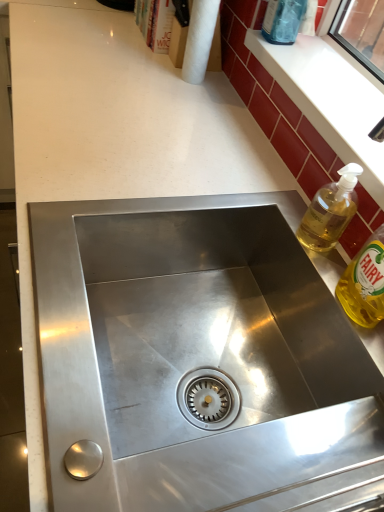
Question: From a real-world perspective, does white glossy window sill at upper right stand above translucent yellow liquid at upper right, which is the 2th bottle from bottom to top?

Choices:
 (A) yes
 (B) no

Answer: (A)

Question: Considering the relative sizes of white glossy window sill at upper right and translucent yellow liquid at upper right, which is the 2th bottle in front-to-back order, in the image provided, is white glossy window sill at upper right bigger than translucent yellow liquid at upper right, which is the 2th bottle in front-to-back order,?

Choices:
 (A) no
 (B) yes

Answer: (B)

Question: Does white glossy window sill at upper right appear on the left side of translucent yellow liquid at upper right, the 2th bottle when ordered from back to front?

Choices:
 (A) no
 (B) yes

Answer: (A)

Question: From the image's perspective, is white glossy window sill at upper right on translucent yellow liquid at upper right, which is the 2th bottle from bottom to top?

Choices:
 (A) no
 (B) yes

Answer: (B)

Question: Considering the relative sizes of white glossy window sill at upper right and translucent yellow liquid at upper right, the second bottle when ordered from top to bottom, in the image provided, is white glossy window sill at upper right taller than translucent yellow liquid at upper right, the second bottle when ordered from top to bottom,?

Choices:
 (A) no
 (B) yes

Answer: (A)

Question: Is white glossy window sill at upper right further to the viewer compared to translucent yellow liquid at upper right, the second bottle when ordered from top to bottom?

Choices:
 (A) no
 (B) yes

Answer: (B)

Question: Is transparent glass bottle at upper right, the 1th bottle when ordered from top to bottom, oriented away from white paper towel at upper center?

Choices:
 (A) no
 (B) yes

Answer: (A)

Question: Considering the relative positions of transparent glass bottle at upper right, the 1th bottle when ordered from top to bottom, and white paper towel at upper center in the image provided, is transparent glass bottle at upper right, the 1th bottle when ordered from top to bottom, to the left of white paper towel at upper center from the viewer's perspective?

Choices:
 (A) yes
 (B) no

Answer: (B)

Question: Would you say white paper towel at upper center is part of transparent glass bottle at upper right, the 3th bottle in the bottom-to-top sequence,'s contents?

Choices:
 (A) no
 (B) yes

Answer: (A)

Question: Is transparent glass bottle at upper right, the 3th bottle in the bottom-to-top sequence, facing towards white paper towel at upper center?

Choices:
 (A) yes
 (B) no

Answer: (B)

Question: From a real-world perspective, is transparent glass bottle at upper right, the 3th bottle in the bottom-to-top sequence, physically below white paper towel at upper center?

Choices:
 (A) yes
 (B) no

Answer: (B)

Question: Is transparent glass bottle at upper right, the third bottle in the front-to-back sequence, at the right side of white paper towel at upper center?

Choices:
 (A) yes
 (B) no

Answer: (A)

Question: Is white glossy window sill at upper right at the back of yellow translucent liquid at right, arranged as the third bottle when viewed from the top?

Choices:
 (A) yes
 (B) no

Answer: (B)